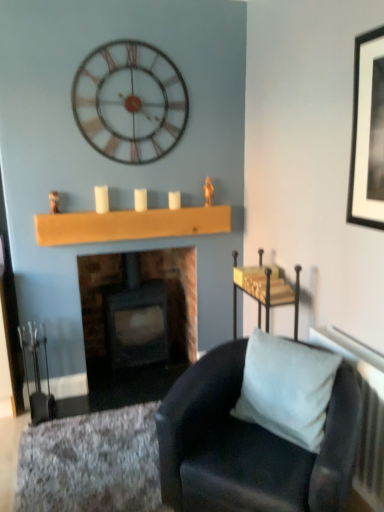
What do you see at coordinates (140, 199) in the screenshot?
I see `white matte candle at center, acting as the second candle starting from the left` at bounding box center [140, 199].

Measure the distance between point (x=277, y=390) and camera.

Point (x=277, y=390) and camera are 1.78 meters apart from each other.

Describe the element at coordinates (250, 445) in the screenshot. The height and width of the screenshot is (512, 384). I see `suede-like black chair at lower right` at that location.

What is the approximate width of suede-like black chair at lower right?

The width of suede-like black chair at lower right is 26.79 inches.

You are a GUI agent. You are given a task and a screenshot of the screen. Output one action in this format:
    pyautogui.click(x=<x>, y=<y>)
    Task: Click on the textured gray rug at lower left
    
    Given the screenshot: What is the action you would take?
    pyautogui.click(x=91, y=463)

Could you tell me if suede-like gray pillow at lower right is turned towards white matte candle at center, arranged as the 3th candle when viewed from the right?

No, suede-like gray pillow at lower right does not turn towards white matte candle at center, arranged as the 3th candle when viewed from the right.

Does suede-like gray pillow at lower right have a lesser width compared to white matte candle at center, arranged as the 3th candle when viewed from the right?

No, suede-like gray pillow at lower right is not thinner than white matte candle at center, arranged as the 3th candle when viewed from the right.

Find the location of a particular element. The image size is (384, 512). pillow on the right of white matte candle at center, placed as the 1th candle when sorted from left to right is located at coordinates (287, 388).

Is white matte candle at center, arranged as the 3th candle when viewed from the right, positioned beyond the bounds of white matte candle at center, the third candle viewed from the left?

white matte candle at center, arranged as the 3th candle when viewed from the right, is positioned outside white matte candle at center, the third candle viewed from the left.

Which of these two, white matte candle at center, placed as the 1th candle when sorted from left to right, or white matte candle at center, the 1th candle in the right-to-left sequence, stands taller?

With more height is white matte candle at center, placed as the 1th candle when sorted from left to right.

Between white matte candle at center, placed as the 1th candle when sorted from left to right, and white matte candle at center, the third candle viewed from the left, which one has larger size?

With larger size is white matte candle at center, placed as the 1th candle when sorted from left to right.

Between white matte candle at center, arranged as the 3th candle when viewed from the right, and white matte candle at center, the third candle viewed from the left, which one appears on the right side from the viewer's perspective?

white matte candle at center, the third candle viewed from the left, is more to the right.

Is suede-like gray pillow at lower right directly adjacent to suede-like black chair at lower right?

No, suede-like gray pillow at lower right is not with suede-like black chair at lower right.

Does suede-like gray pillow at lower right have a greater height compared to suede-like black chair at lower right?

No.

There is a suede-like black chair at lower right. Identify the location of pillow above it (from a real-world perspective). click(x=287, y=388).

Is there a large distance between wooden plank at center and suede-like black chair at lower right?

Yes, wooden plank at center and suede-like black chair at lower right are located far from each other.

Which object is further away from the camera, wooden plank at center or suede-like black chair at lower right?

wooden plank at center is further away from the camera.

In the scene shown: From a real-world perspective, between wooden plank at center and suede-like black chair at lower right, who is vertically higher?

wooden plank at center, from a real-world perspective.

Where is `chair in front of the wooden plank at center`? This screenshot has height=512, width=384. chair in front of the wooden plank at center is located at coordinates (250, 445).

Locate an element on the screen. This screenshot has width=384, height=512. radiator below the white matte candle at center, acting as the second candle starting from the left (from the image's perspective) is located at coordinates (363, 409).

Which is less distant, (138, 211) or (359, 446)?

Point (138, 211).

Is suede-like gray pillow at lower right facing away from metallic gold tray at upper right?

No, suede-like gray pillow at lower right is not facing the opposite direction of metallic gold tray at upper right.

What's the angular difference between suede-like gray pillow at lower right and metallic gold tray at upper right's facing directions?

28.9 degrees.

Between point (297, 429) and point (244, 284), which one is positioned behind?

The point (244, 284) is farther.

Considering the sizes of objects suede-like gray pillow at lower right and metallic gold tray at upper right in the image provided, who is taller, suede-like gray pillow at lower right or metallic gold tray at upper right?

metallic gold tray at upper right.

Is white textured radiator at lower right positioned beyond the bounds of wooden plank at center?

Absolutely, white textured radiator at lower right is external to wooden plank at center.

Is white textured radiator at lower right oriented towards wooden plank at center?

No, white textured radiator at lower right does not turn towards wooden plank at center.

In order to click on radiator located underneath the wooden plank at center (from a real-world perspective) in this screenshot , I will do `click(363, 409)`.

Is white textured radiator at lower right not near wooden plank at center?

white textured radiator at lower right is far away from wooden plank at center.

Where is `pillow that appears below the white matte candle at center, arranged as the 3th candle when viewed from the right (from a real-world perspective)`? The width and height of the screenshot is (384, 512). pillow that appears below the white matte candle at center, arranged as the 3th candle when viewed from the right (from a real-world perspective) is located at coordinates (287, 388).

Where is `the 2nd candle counting from the right side of the white matte candle at center, placed as the 1th candle when sorted from left to right`? the 2nd candle counting from the right side of the white matte candle at center, placed as the 1th candle when sorted from left to right is located at coordinates (174, 200).

Considering their positions, is white matte candle at center, acting as the second candle starting from the left, positioned further to metallic gold tray at upper right than suede-like gray pillow at lower right?

white matte candle at center, acting as the second candle starting from the left, lies further to metallic gold tray at upper right than the other object.

Based on their spatial positions, is textured gray rug at lower left or white matte candle at center, the 1th candle in the right-to-left sequence, closer to metallic/wooden wall clock at upper center?

white matte candle at center, the 1th candle in the right-to-left sequence, lies closer to metallic/wooden wall clock at upper center than the other object.

Looking at the image, which one is located further to white matte candle at center, the 1th candle in the right-to-left sequence, white matte candle at center, arranged as the 3th candle when viewed from the right, or dark gray stone fireplace at center?

dark gray stone fireplace at center is further to white matte candle at center, the 1th candle in the right-to-left sequence.

From the image, which object appears to be nearer to metallic/wooden wall clock at upper center, white matte candle at center, the second candle viewed from the right, or wooden plank at center?

white matte candle at center, the second candle viewed from the right, is closer to metallic/wooden wall clock at upper center.

When comparing their distances from wooden plank at center, does white matte candle at center, acting as the second candle starting from the left, or white textured radiator at lower right seem further?

The object further to wooden plank at center is white textured radiator at lower right.

Which object lies nearer to the anchor point dark gray stone fireplace at center, white matte candle at center, arranged as the 3th candle when viewed from the right, or textured gray rug at lower left?

textured gray rug at lower left is closer to dark gray stone fireplace at center.

From the picture: Considering their positions, is suede-like gray pillow at lower right positioned further to dark gray stone fireplace at center than metallic/wooden wall clock at upper center?

suede-like gray pillow at lower right.

When comparing their distances from wooden plank at center, does dark gray stone fireplace at center or white matte candle at center, arranged as the 3th candle when viewed from the right, seem closer?

white matte candle at center, arranged as the 3th candle when viewed from the right, is closer to wooden plank at center.

Identify the location of furniture between suede-like black chair at lower right and wooden plank at center along the z-axis. The height and width of the screenshot is (512, 384). (264, 290).

At what (x,y) coordinates should I click in order to perform the action: click on pillow located between textured gray rug at lower left and white textured radiator at lower right in the left-right direction. Please return your answer as a coordinate pair (x, y). The width and height of the screenshot is (384, 512). Looking at the image, I should click on (287, 388).

Locate an element on the screen. furniture between suede-like black chair at lower right and white matte candle at center, placed as the 1th candle when sorted from left to right, in the front-back direction is located at coordinates (264, 290).

This screenshot has height=512, width=384. What are the coordinates of `furniture between wooden plank at center and textured gray rug at lower left from top to bottom` in the screenshot? It's located at [264, 290].